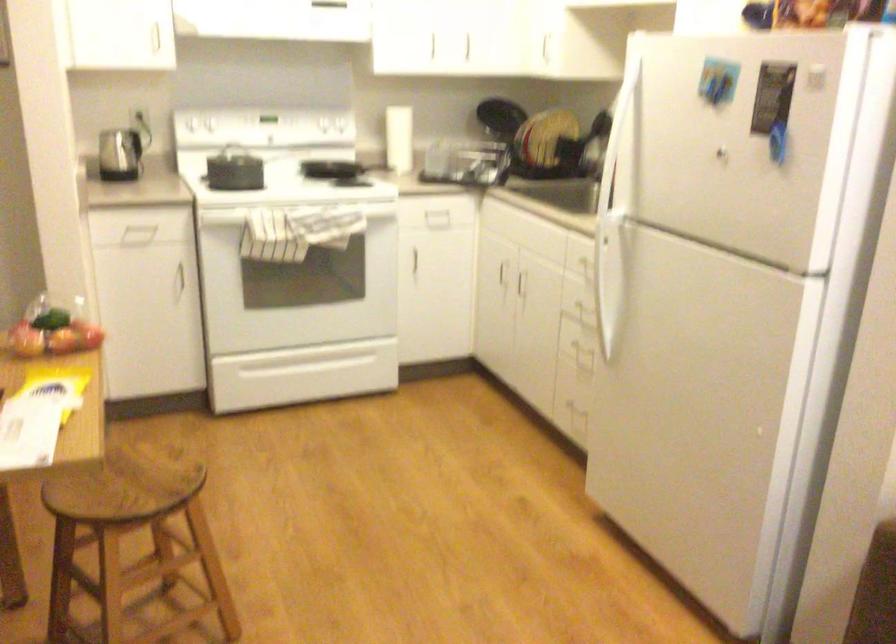
This screenshot has width=896, height=644. I want to click on white refrigerator handle, so click(607, 283).